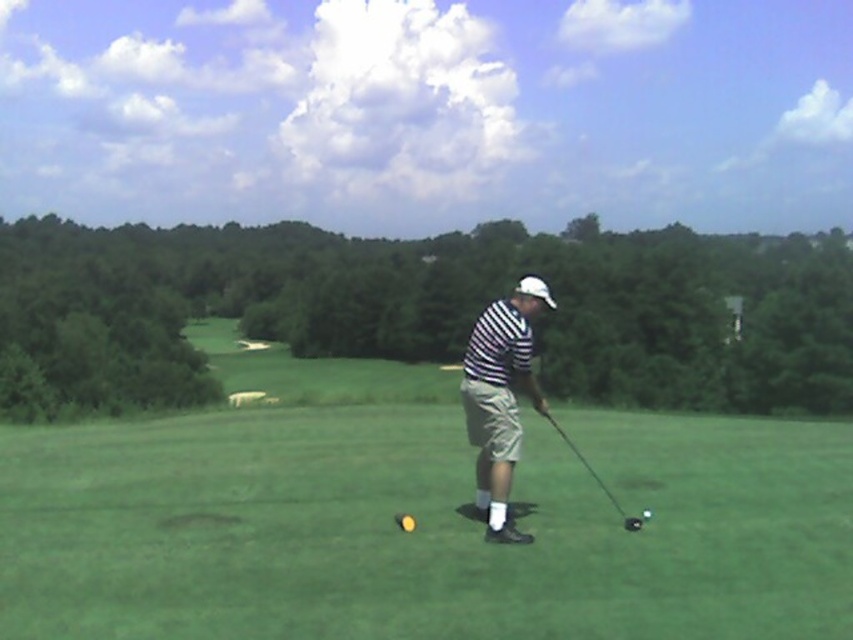
You are a golfer standing on the course and see the shiny black golf club at center and the shiny black golf ball at center. Which object is positioned to the left of the other?

The shiny black golf club at center is to the left of the shiny black golf ball at center.

You are a golfer trying to decide whether to use the shiny black golf club at center to hit the shiny black golf ball at center. Can you determine if the club is wider than the ball?

The shiny black golf club at center might be wider than shiny black golf golf ball at center, so it is possible that the club is wider than the ball, but the exact width is uncertain.

You are a golfer standing on the green grass at center. You want to hit the ball to the hole located at point 0.811, 0.489. What is the direction you should aim?

The hole is located at the same position as the green grass at center, which is at point [416,518]. Therefore, you should aim directly at the green grass at center to reach the hole.